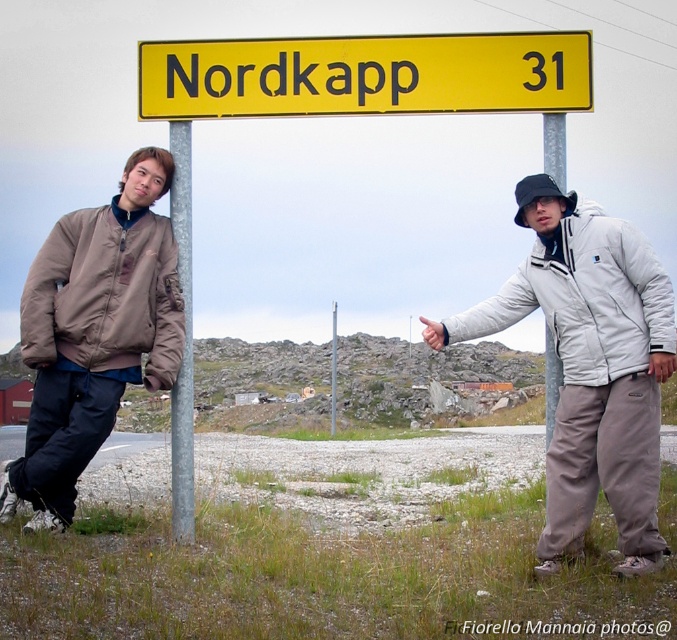
You are a photographer trying to capture a photo of the two people near the sign. The camera you are using has a maximum focus range of 1.2 meters. Can you take a clear photo of both the matte brown bomber jacket at left and the silver metallic pole at left without moving the camera?

The matte brown bomber jacket at left is 1.15 meters away from the silver metallic pole at left. Since the distance between them is within the camera maximum focus range of 1.2 meters, you can take a clear photo of both the matte brown bomber jacket at left and the silver metallic pole at left without moving the camera.

You are planning to take a photo of the silver metallic pole at left and the matte brown bomber jacket at left. Which object should be placed closer to the camera to ensure both are in focus?

The matte brown bomber jacket at left is shorter than the silver metallic pole at left, so to ensure both are in focus, place the matte brown bomber jacket at left closer to the camera.

You are a photographer trying to capture both the matte brown jacket at left and the white fleece jacket at right in a single frame. Based on their positions, which jacket is closer to the camera?

The matte brown jacket at left is to the left of the white fleece jacket at right, so the matte brown jacket at left is closer to the camera.